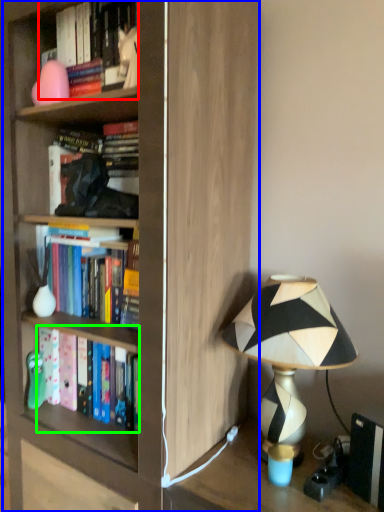
Question: Considering the real-world distances, which object is farthest from book (highlighted by a red box)? bookcase (highlighted by a blue box) or book (highlighted by a green box)?

Choices:
 (A) bookcase
 (B) book

Answer: (B)